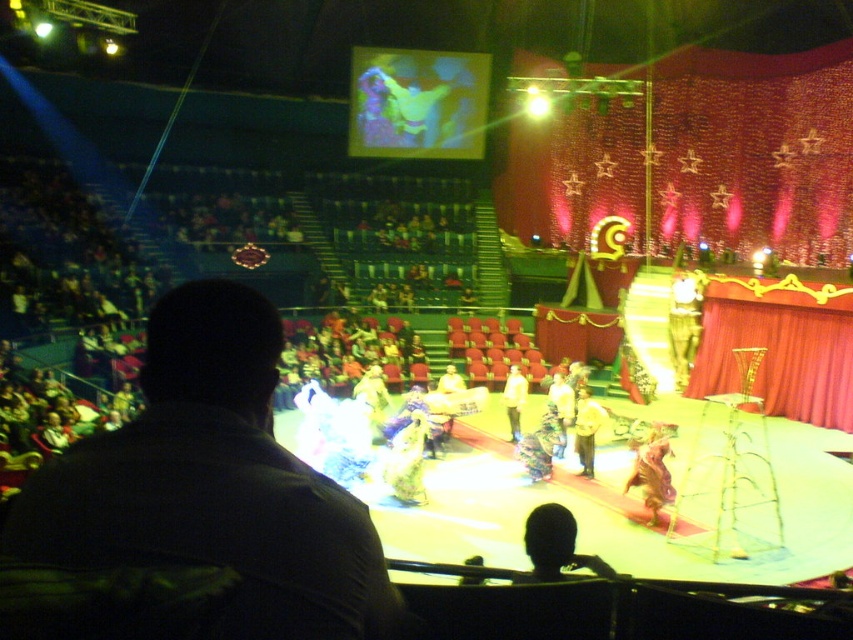
Question: Can you confirm if dark brown leather jacket at center is positioned to the right of yellow fabric pants at center?

Choices:
 (A) no
 (B) yes

Answer: (A)

Question: Based on their relative distances, which object is farther from the dark brown leather jacket at center?

Choices:
 (A) red velvet curtain at right
 (B) printed fabric outfit at center
 (C) fluffy brown fur at center

Answer: (A)

Question: Among these objects, which one is farthest from the camera?

Choices:
 (A) dark brown leather jacket at center
 (B) printed fabric outfit at center
 (C) red velvet curtain at right
 (D) yellow fabric pants at center

Answer: (C)

Question: Considering the real-world distances, which object is farthest from the red velvet curtain at right?

Choices:
 (A) yellow fabric pants at center
 (B) printed fabric outfit at center
 (C) yellow fabric at center

Answer: (C)

Question: Does red velvet curtain at right have a greater width compared to yellow fabric at center?

Choices:
 (A) yes
 (B) no

Answer: (B)

Question: Does red velvet curtain at right appear over printed fabric outfit at center?

Choices:
 (A) yes
 (B) no

Answer: (B)